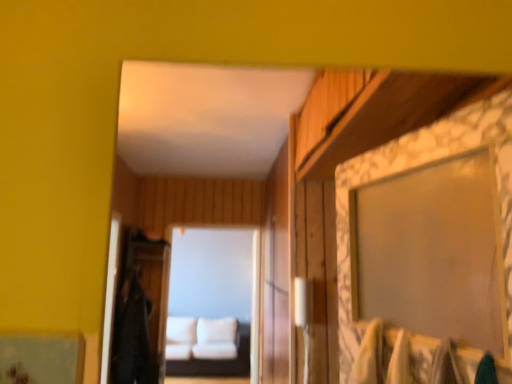
Question: From a real-world perspective, is white fabric couch at center beneath white fabric couch at center?

Choices:
 (A) no
 (B) yes

Answer: (B)

Question: Could you tell me if white fabric couch at center is facing white fabric couch at center?

Choices:
 (A) no
 (B) yes

Answer: (B)

Question: Are white fabric couch at center and white fabric couch at center making contact?

Choices:
 (A) yes
 (B) no

Answer: (B)

Question: Does white fabric couch at center appear on the right side of white fabric couch at center?

Choices:
 (A) no
 (B) yes

Answer: (A)

Question: Is white fabric couch at center taller than white fabric couch at center?

Choices:
 (A) yes
 (B) no

Answer: (B)

Question: Can you confirm if white fabric couch at center is smaller than white fabric couch at center?

Choices:
 (A) no
 (B) yes

Answer: (A)

Question: Is white fabric couch at center located within black fabric robe at left?

Choices:
 (A) yes
 (B) no

Answer: (B)

Question: Is black fabric robe at left at the left side of white fabric couch at center?

Choices:
 (A) yes
 (B) no

Answer: (A)

Question: Considering the relative sizes of black fabric robe at left and white fabric couch at center in the image provided, is black fabric robe at left thinner than white fabric couch at center?

Choices:
 (A) no
 (B) yes

Answer: (B)

Question: From a real-world perspective, is black fabric robe at left positioned over white fabric couch at center based on gravity?

Choices:
 (A) no
 (B) yes

Answer: (B)

Question: Can you confirm if black fabric robe at left is positioned to the right of white fabric couch at center?

Choices:
 (A) no
 (B) yes

Answer: (A)

Question: Is black fabric robe at left facing towards white fabric couch at center?

Choices:
 (A) yes
 (B) no

Answer: (B)

Question: Is white fabric couch at center to the left of white fabric couch at center from the viewer's perspective?

Choices:
 (A) yes
 (B) no

Answer: (B)